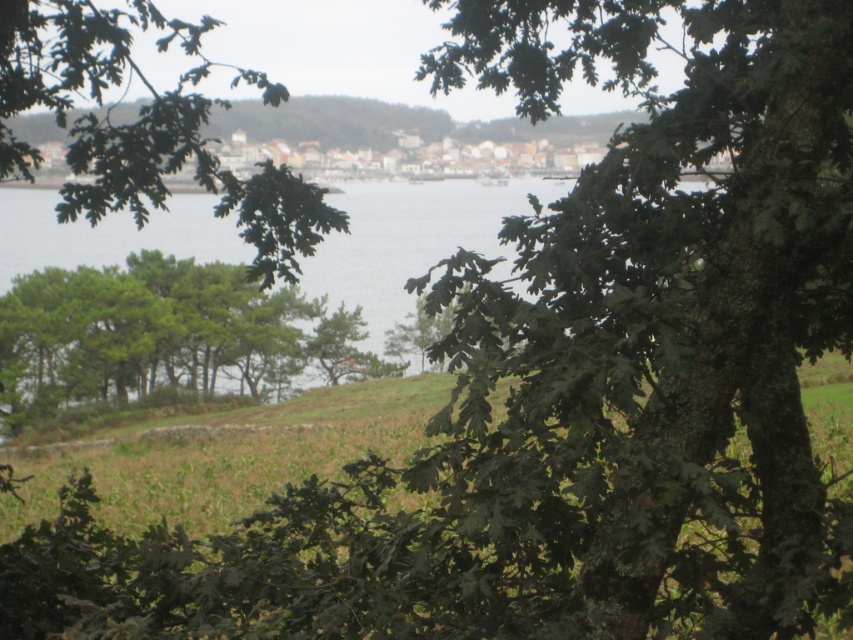
Question: Which of the following is the farthest from the observer?

Choices:
 (A) (282, 253)
 (B) (9, 216)

Answer: (B)

Question: Which point is closer to the camera?

Choices:
 (A) (19, 17)
 (B) (447, 230)

Answer: (A)

Question: In this image, where is green leafy tree at center located relative to green water at center?

Choices:
 (A) left
 (B) right

Answer: (A)

Question: Does green leafy tree at center have a greater width compared to green water at center?

Choices:
 (A) no
 (B) yes

Answer: (A)

Question: From the image, what is the correct spatial relationship of green leafy tree at center in relation to green water at center?

Choices:
 (A) left
 (B) right

Answer: (A)